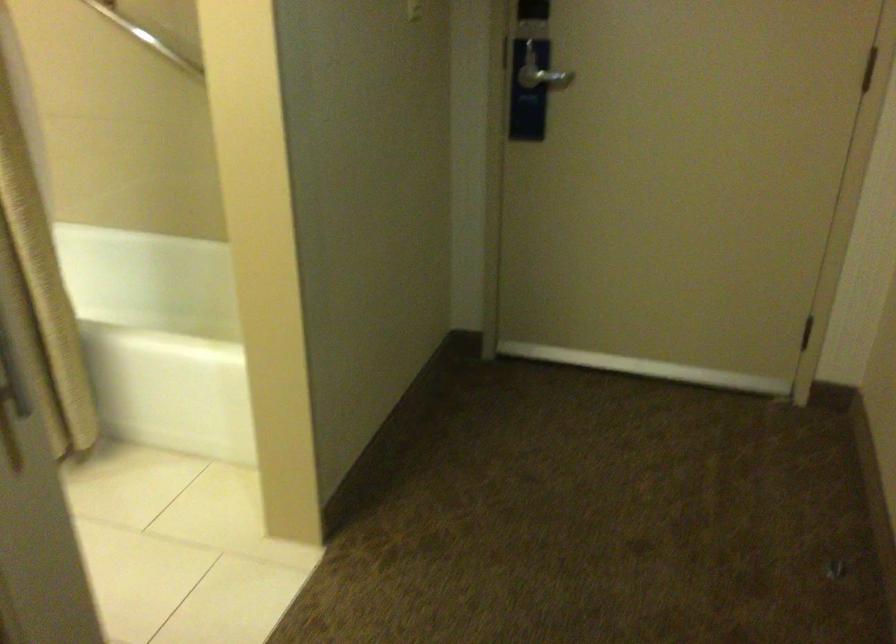
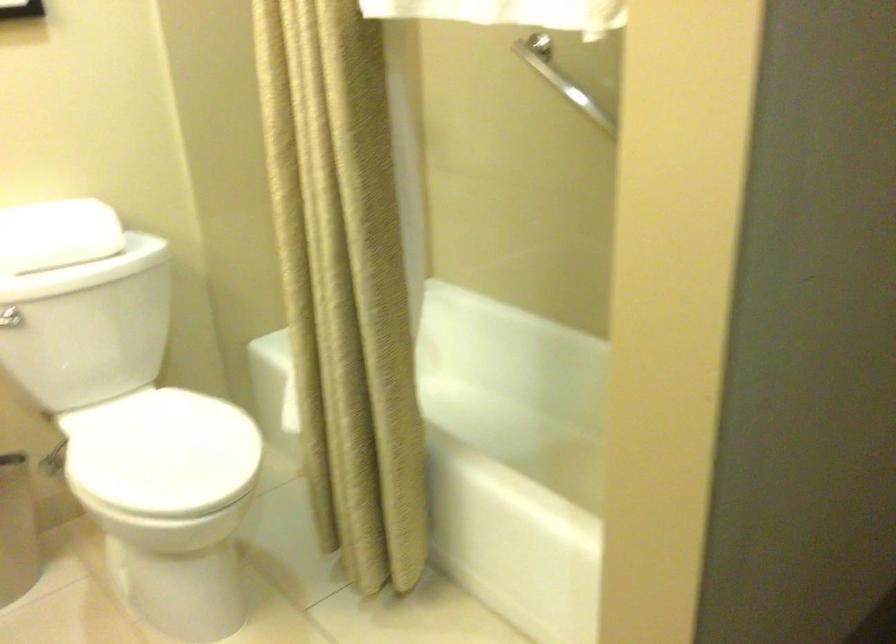
Question: The images are taken continuously from a first-person perspective. In which direction is your viewpoint rotating?

Choices:
 (A) Left
 (B) Right
 (C) Up
 (D) Down

Answer: (A)